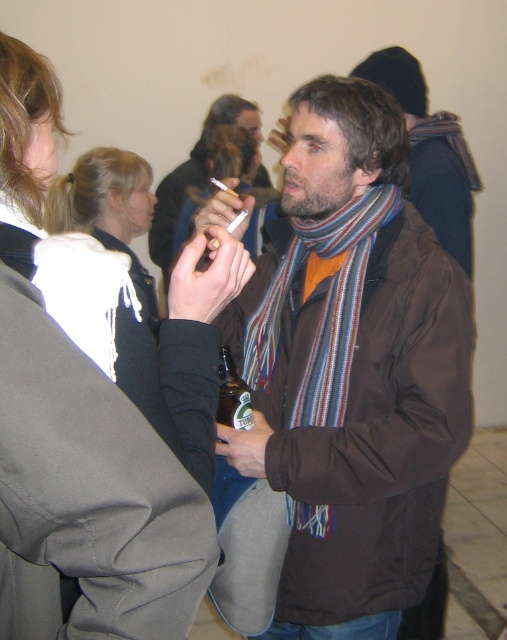
Question: Which point is farther to the camera?

Choices:
 (A) (221, 419)
 (B) (152, 250)
 (C) (406, 209)
 (D) (74, 184)

Answer: (B)

Question: Is brown matte jacket at center positioned at the back of white fleece jacket at upper left?

Choices:
 (A) yes
 (B) no

Answer: (A)

Question: Does brown matte jacket at center appear on the right side of green glass bottle at center?

Choices:
 (A) yes
 (B) no

Answer: (A)

Question: Among these objects, which one is nearest to the camera?

Choices:
 (A) striped scarf at center
 (B) white fabric scarf at upper left
 (C) brown matte jacket at center

Answer: (B)

Question: Can you confirm if white fabric scarf at upper left is positioned below green glass bottle at center?

Choices:
 (A) no
 (B) yes

Answer: (A)

Question: Which point is closer to the camera taking this photo?

Choices:
 (A) (133, 257)
 (B) (250, 404)

Answer: (B)